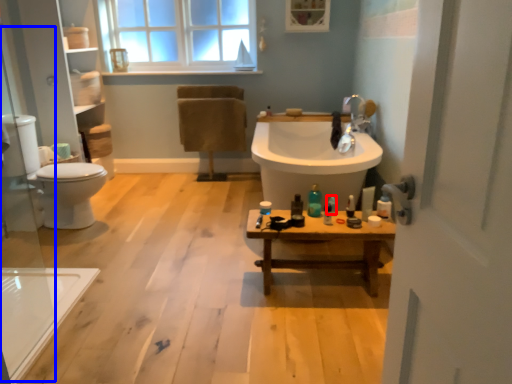
Question: Which point is further to the camera, toiletry (highlighted by a red box) or glass door (highlighted by a blue box)?

Choices:
 (A) toiletry
 (B) glass door

Answer: (A)